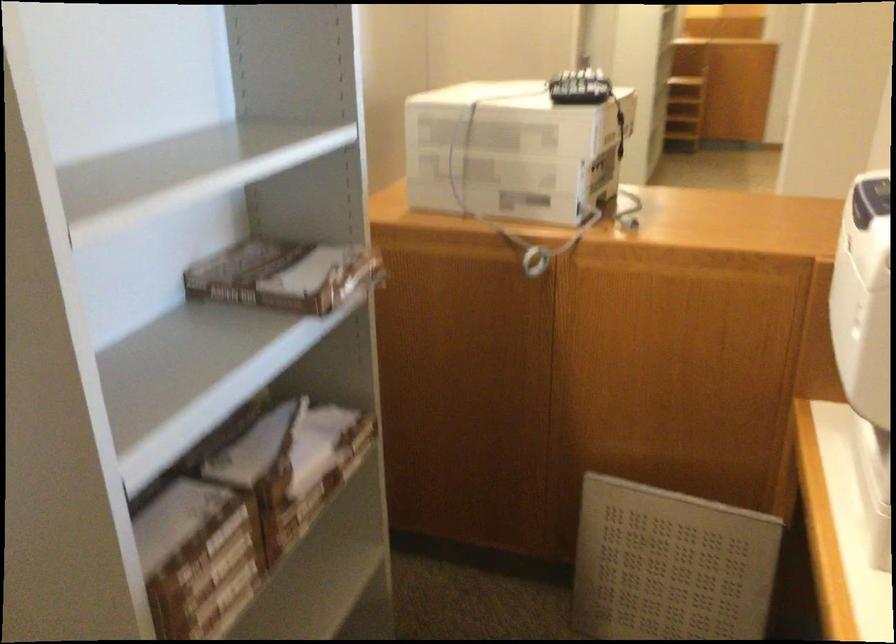
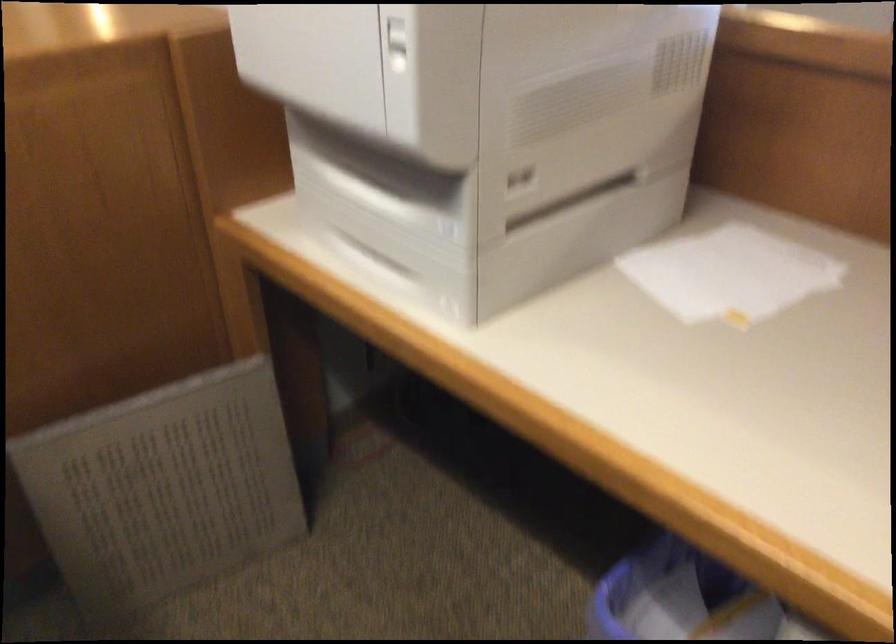
The first image is from the beginning of the video and the second image is from the end. How did the camera likely rotate when shooting the video?

The camera rotated toward right-down.